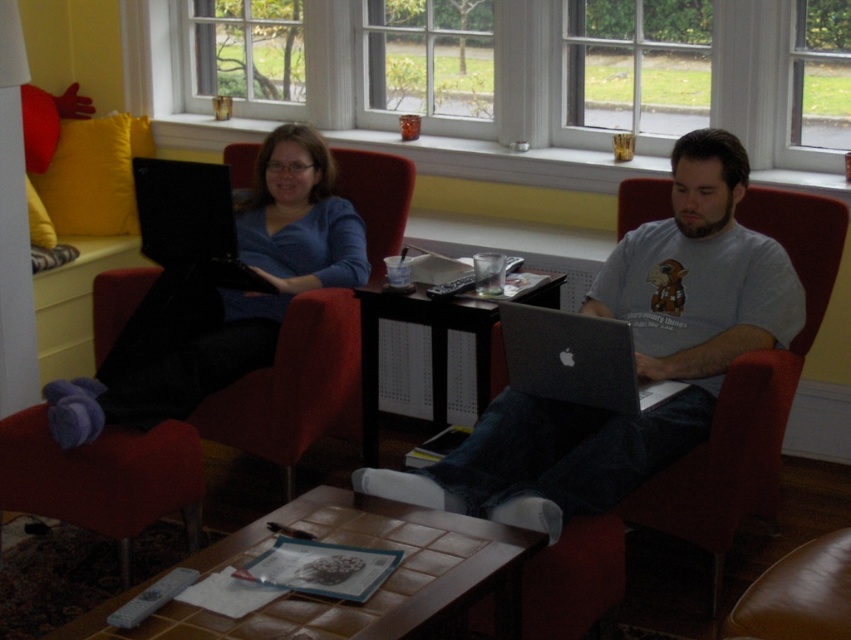
Is brown tile table at center bigger than silver metallic laptop at center?

Yes, brown tile table at center is bigger than silver metallic laptop at center.

Does brown tile table at center appear on the right side of silver metallic laptop at center?

No, brown tile table at center is not to the right of silver metallic laptop at center.

Locate an element on the screen. Image resolution: width=851 pixels, height=640 pixels. brown tile table at center is located at coordinates (351, 604).

The image size is (851, 640). Describe the element at coordinates (747, 397) in the screenshot. I see `red fabric chair at center` at that location.

Who is more distant from viewer, (741, 380) or (220, 275)?

The point (220, 275) is more distant.

Where is `red fabric chair at center`? The height and width of the screenshot is (640, 851). red fabric chair at center is located at coordinates (747, 397).

Describe the element at coordinates (747, 397) in the screenshot. I see `red fabric chair at center` at that location.

Does red fabric chair at center come behind black fabric armchair at left?

No, it is in front of black fabric armchair at left.

Find the location of `red fabric chair at center`. red fabric chair at center is located at coordinates (747, 397).

The width and height of the screenshot is (851, 640). I want to click on red fabric chair at center, so click(747, 397).